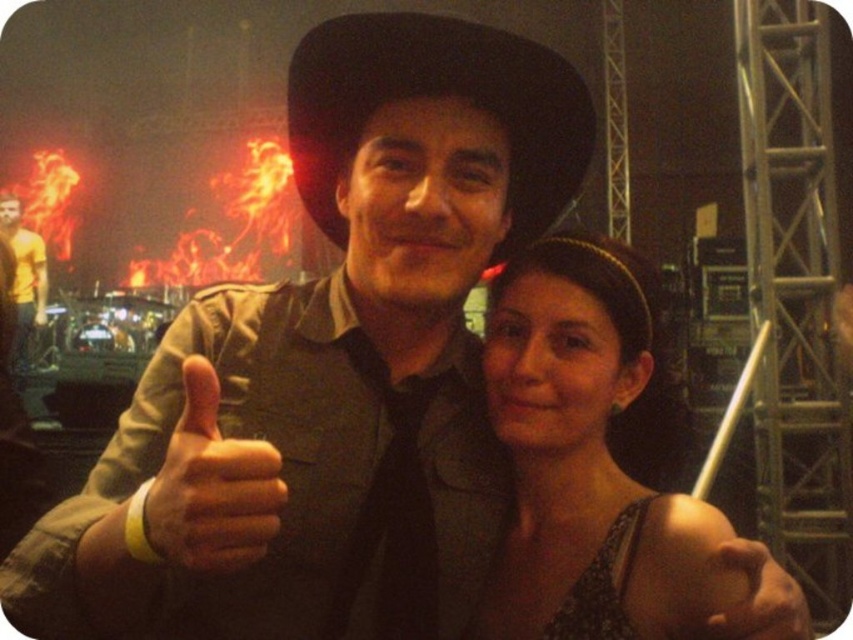
How much distance is there between black felt fedora at center and yellow t-shirt at left?

black felt fedora at center and yellow t-shirt at left are 24.48 feet apart.

Looking at this image, is black felt fedora at center above yellow t-shirt at left?

Incorrect, black felt fedora at center is not positioned above yellow t-shirt at left.

Consider the image. Who is more distant from viewer, [573,179] or [30,330]?

The point [30,330] is behind.

Identify the location of black felt fedora at center. (437, 93).

The height and width of the screenshot is (640, 853). I want to click on smooth skin hand at center, so click(758, 600).

Can you confirm if smooth skin hand at center is taller than yellow t-shirt at left?

In fact, smooth skin hand at center may be shorter than yellow t-shirt at left.

Locate an element on the screen. This screenshot has width=853, height=640. smooth skin hand at center is located at coordinates (758, 600).

This screenshot has width=853, height=640. What are the coordinates of `smooth skin hand at center` in the screenshot? It's located at (758, 600).

Who is more distant from viewer, (659, 497) or (212, 490)?

The point (659, 497) is behind.

Between matte black dress at center and matte black hand at center, which one appears on the right side from the viewer's perspective?

matte black dress at center is more to the right.

Between point (515, 316) and point (244, 552), which one is positioned behind?

The point (515, 316) is more distant.

Locate an element on the screen. The image size is (853, 640). matte black dress at center is located at coordinates (585, 449).